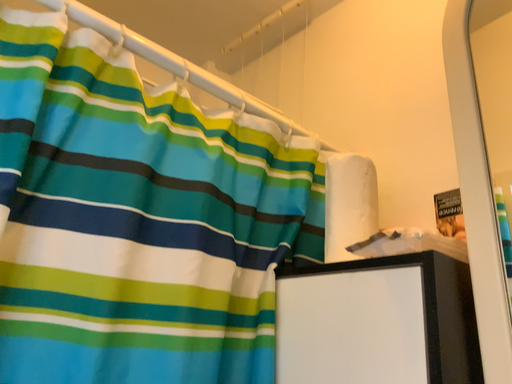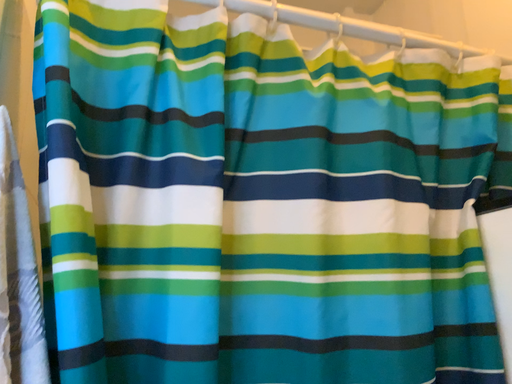
Question: How did the camera likely rotate when shooting the video?

Choices:
 (A) rotated downward
 (B) rotated upward

Answer: (A)